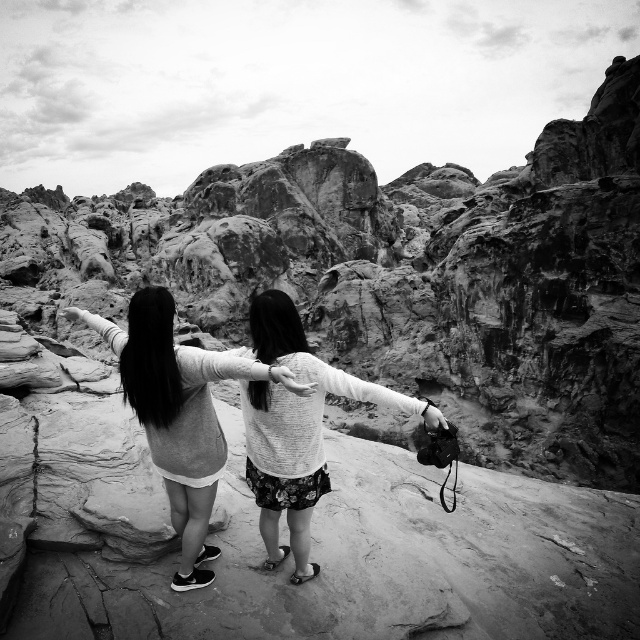
Question: Is light gray sweater at center positioned at the back of fluffy white sweater at center?

Choices:
 (A) yes
 (B) no

Answer: (B)

Question: Which of the following is the closest to the observer?

Choices:
 (A) (429, 417)
 (B) (180, 448)

Answer: (B)

Question: Can you confirm if light gray sweater at center is positioned below fluffy white sweater at center?

Choices:
 (A) no
 (B) yes

Answer: (A)

Question: Which point is closer to the camera?

Choices:
 (A) (282, 352)
 (B) (141, 332)

Answer: (B)

Question: Does light gray sweater at center appear over fluffy white sweater at center?

Choices:
 (A) yes
 (B) no

Answer: (A)